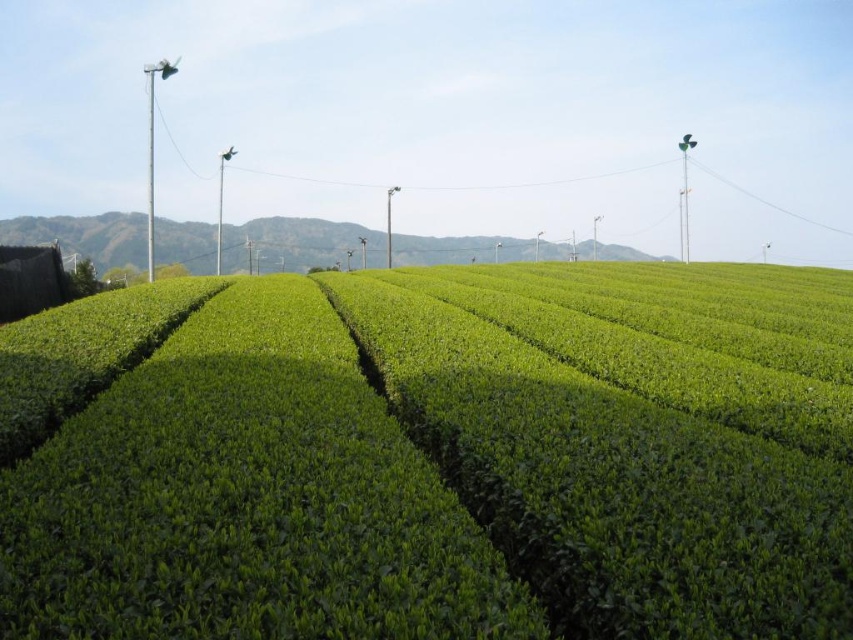
Does green leafy field at center have a larger size compared to green grassy hill at center?

Incorrect, green leafy field at center is not larger than green grassy hill at center.

Is point (178, 324) positioned after point (192, 240)?

No, it is in front of (192, 240).

Identify the location of green leafy field at center. This screenshot has width=853, height=640. (433, 458).